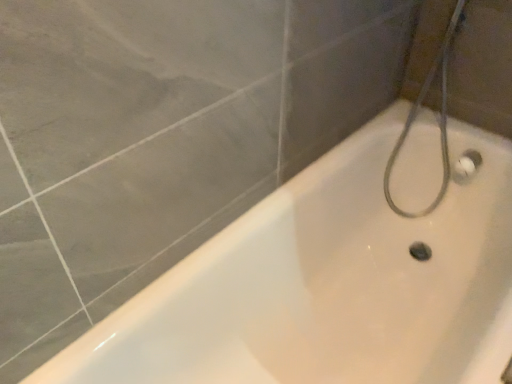
Question: Is white rubber hose at upper right wider than white glossy bathtub at center?

Choices:
 (A) yes
 (B) no

Answer: (B)

Question: Is white glossy bathtub at center surrounded by white rubber hose at upper right?

Choices:
 (A) no
 (B) yes

Answer: (A)

Question: From the image's perspective, is white rubber hose at upper right above white glossy bathtub at center?

Choices:
 (A) yes
 (B) no

Answer: (A)

Question: Is white rubber hose at upper right closer to the viewer compared to white glossy bathtub at center?

Choices:
 (A) no
 (B) yes

Answer: (A)

Question: Is white rubber hose at upper right facing away from white glossy bathtub at center?

Choices:
 (A) no
 (B) yes

Answer: (A)

Question: Is white rubber hose at upper right shorter than white glossy bathtub at center?

Choices:
 (A) yes
 (B) no

Answer: (B)

Question: Does white glossy bathtub at center appear on the left side of white rubber hose at upper right?

Choices:
 (A) no
 (B) yes

Answer: (B)

Question: Is the position of white glossy bathtub at center less distant than that of white rubber hose at upper right?

Choices:
 (A) yes
 (B) no

Answer: (A)

Question: Considering the relative sizes of white glossy bathtub at center and white rubber hose at upper right in the image provided, is white glossy bathtub at center bigger than white rubber hose at upper right?

Choices:
 (A) no
 (B) yes

Answer: (B)

Question: Is there a large distance between white glossy bathtub at center and white rubber hose at upper right?

Choices:
 (A) yes
 (B) no

Answer: (B)

Question: Is white glossy bathtub at center smaller than white rubber hose at upper right?

Choices:
 (A) yes
 (B) no

Answer: (B)

Question: Is white rubber hose at upper right surrounded by white glossy bathtub at center?

Choices:
 (A) no
 (B) yes

Answer: (B)

Question: Considering the relative positions of white rubber hose at upper right and white glossy bathtub at center in the image provided, is white rubber hose at upper right to the left or to the right of white glossy bathtub at center?

Choices:
 (A) right
 (B) left

Answer: (A)